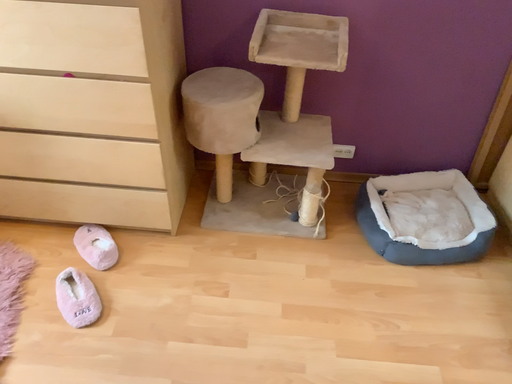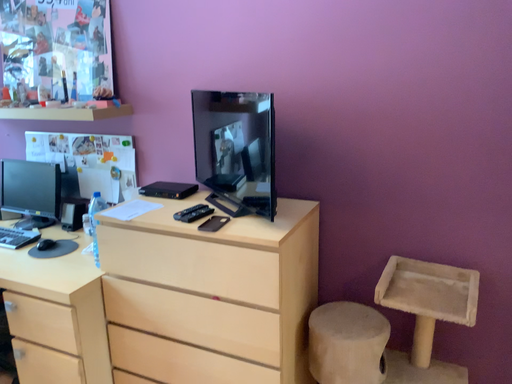
Question: How did the camera likely rotate when shooting the video?

Choices:
 (A) rotated left
 (B) rotated right

Answer: (A)